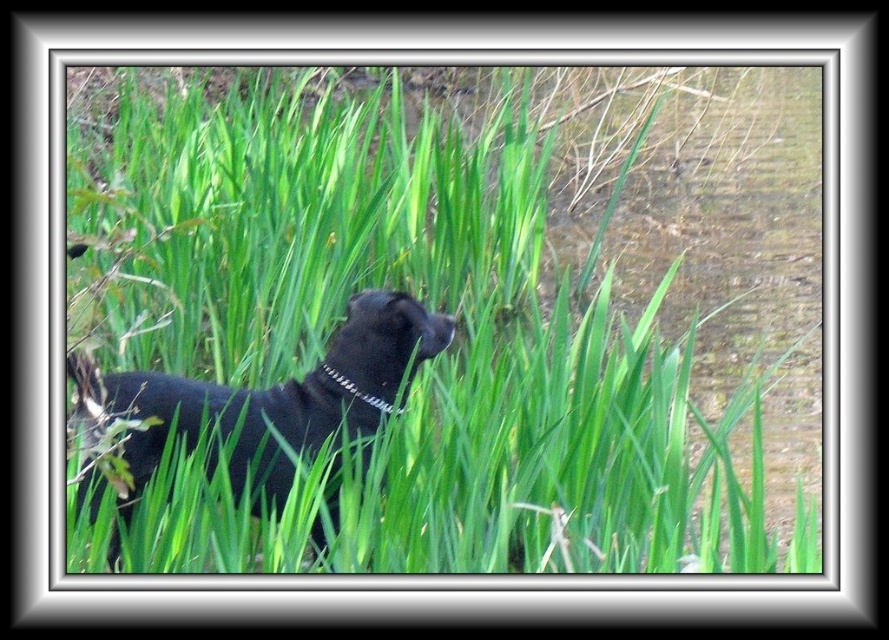
Based on the scene description, where is the green leafy grass at center located in the image?

The green leafy grass at center is located at the 2D coordinate point of (413, 323).

You are a photographer trying to capture the black dog in the scene. You notice two points marked in the image. The first point is at coordinates point [277,253] and the second is at point [386,381]. Which point is closer to your camera?

Point [277,253] is further to the camera than point [386,381], so the second point is closer to the camera.

Looking at this image, you are a photographer trying to capture the black matte dog at center and the green leafy grass at center in a single shot. Based on their positions, which object should you adjust your camera focus to first to ensure both are in frame?

Since the green leafy grass at center is positioned on the right side of the black matte dog at center, you should first focus on the black matte dog at center to ensure it is centered and then adjust slightly to the right to include the green leafy grass at center in the frame.